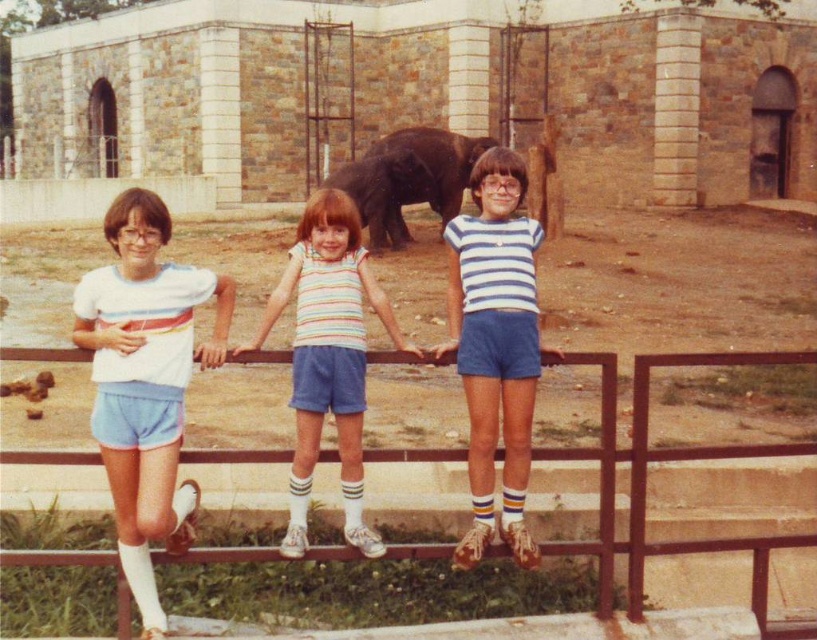
Question: Is white cotton shorts at left above metallic brown fence at center?

Choices:
 (A) no
 (B) yes

Answer: (B)

Question: In this image, where is metallic brown fence at center located relative to dark brown elephant at center?

Choices:
 (A) left
 (B) right

Answer: (B)

Question: Estimate the real-world distances between objects in this image. Which object is closer to the white cotton shorts at left?

Choices:
 (A) striped fabric shorts at center
 (B) metallic brown fence at center
 (C) dark brown elephant at center

Answer: (A)

Question: Which point appears closest to the camera in this image?

Choices:
 (A) (458, 300)
 (B) (166, 472)
 (C) (358, 404)
 (D) (605, 545)

Answer: (B)

Question: Among these objects, which one is farthest from the camera?

Choices:
 (A) striped fabric shorts at center
 (B) metallic brown fence at center

Answer: (A)

Question: Is white cotton shorts at left to the left of striped fabric shorts at center from the viewer's perspective?

Choices:
 (A) no
 (B) yes

Answer: (B)